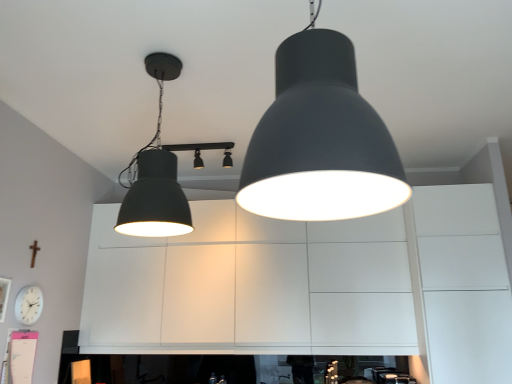
The image size is (512, 384). I want to click on free point above matte black lampshade at upper left, which is the 2th lamp in front-to-back order (from a real-world perspective), so click(x=172, y=55).